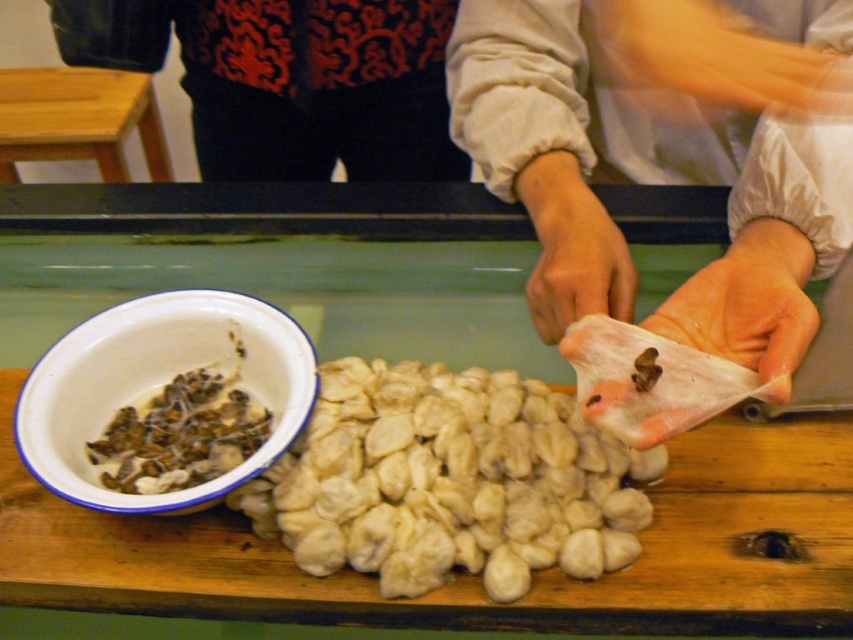
Question: Which point appears closest to the camera in this image?

Choices:
 (A) (399, 65)
 (B) (519, 288)
 (C) (395, 392)

Answer: (C)

Question: Is wooden table at center to the left of white dough dumplings at center from the viewer's perspective?

Choices:
 (A) yes
 (B) no

Answer: (A)

Question: Which object appears closest to the camera in this image?

Choices:
 (A) wooden table at center
 (B) white paper at center
 (C) wooden table at left

Answer: (B)

Question: Which point is farther from the camera taking this photo?

Choices:
 (A) (128, 419)
 (B) (268, 536)

Answer: (A)

Question: Does white dough dumplings at center have a greater width compared to white enamel bowl at lower left?

Choices:
 (A) no
 (B) yes

Answer: (B)

Question: Is white paper at center above wooden table at left?

Choices:
 (A) no
 (B) yes

Answer: (A)